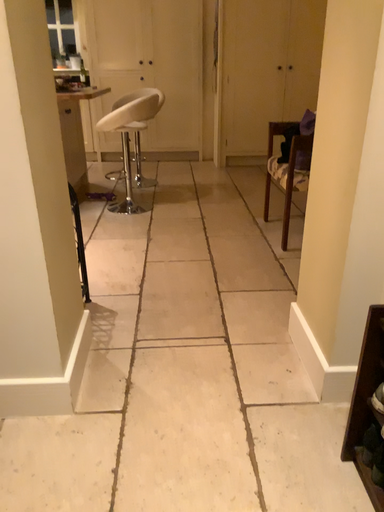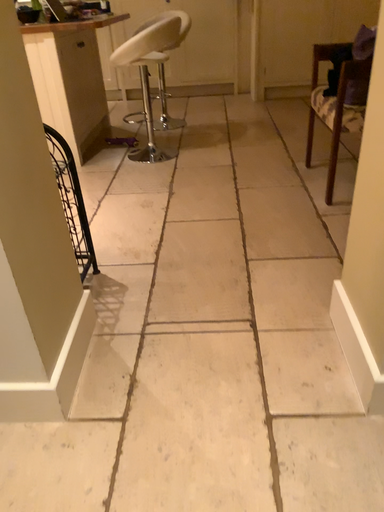
Question: Which way did the camera rotate in the video?

Choices:
 (A) rotated upward
 (B) rotated downward

Answer: (B)